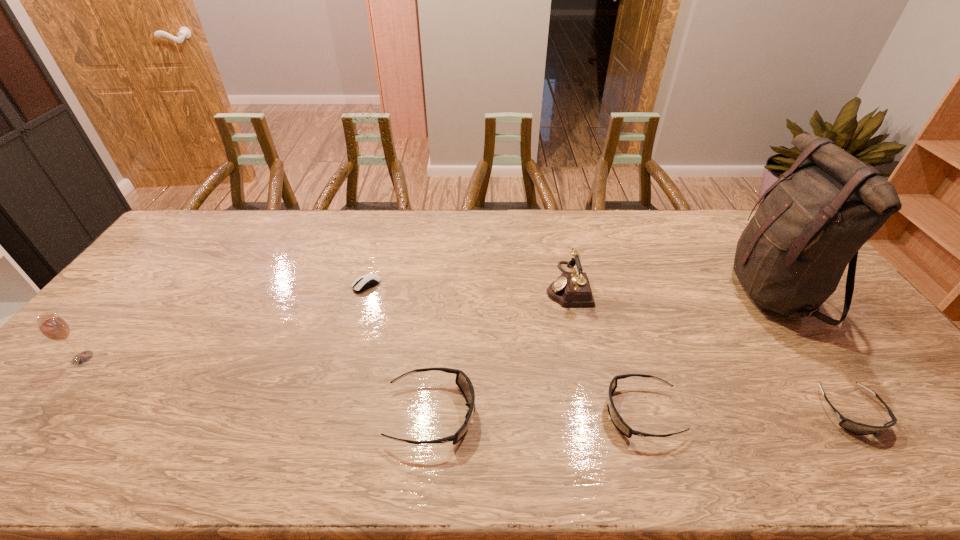
The image size is (960, 540). I want to click on vacant area that lies between the shortest goggles and the shortest object, so click(609, 348).

Where is `object that stands as the closest to the second shortest goggles`? object that stands as the closest to the second shortest goggles is located at coordinates (571, 289).

Identify which object is the third nearest to the shortest object. Please provide its 2D coordinates. Your answer should be formatted as a tuple, i.e. [(x, y)], where the tuple contains the x and y coordinates of a point satisfying the conditions above.

[(53, 327)]

Where is `goggles that is the second nearest to the second shortest object`? This screenshot has height=540, width=960. goggles that is the second nearest to the second shortest object is located at coordinates (462, 380).

Locate an element on the screen. The width and height of the screenshot is (960, 540). goggles that is the nearest to the wineglass is located at coordinates (462, 380).